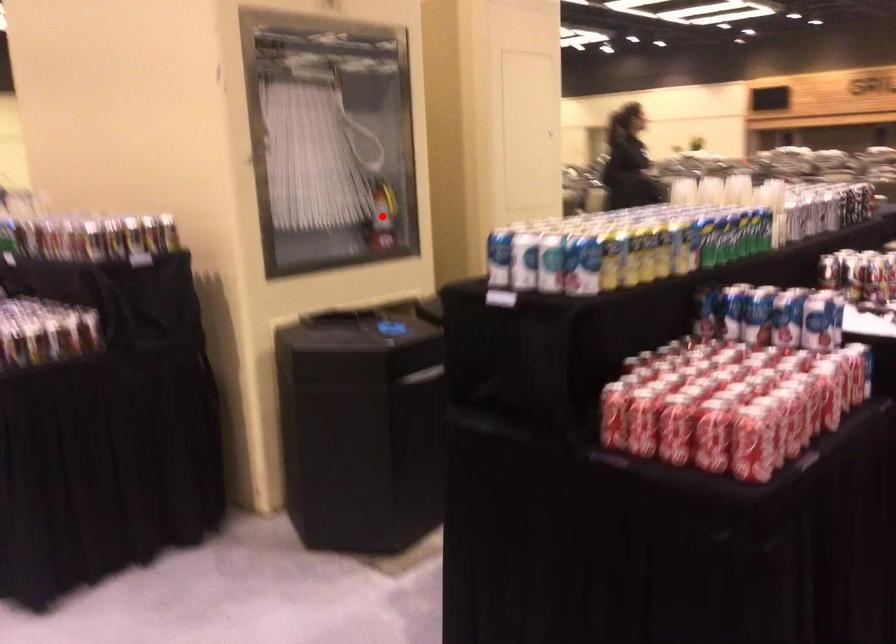
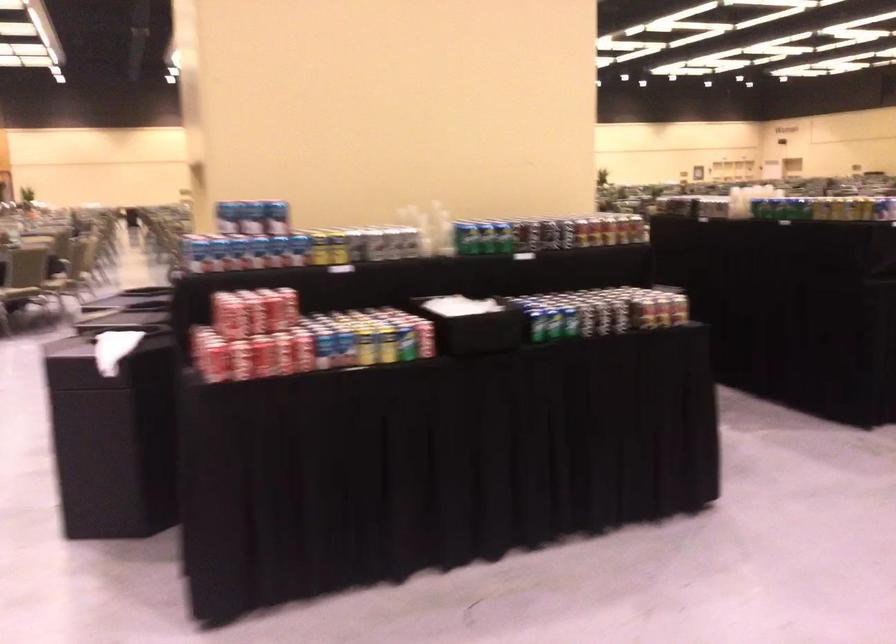
Question: I am providing you with two images of the same scene from different viewpoints. A red point is marked on the first image. Is the red point's position out of view in image 2?

Choices:
 (A) Yes
 (B) No

Answer: (A)